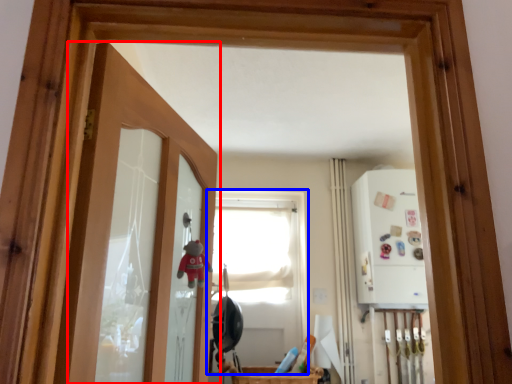
Question: Which of the following is the farthest to the observer, door (highlighted by a red box) or window (highlighted by a blue box)?

Choices:
 (A) door
 (B) window

Answer: (B)